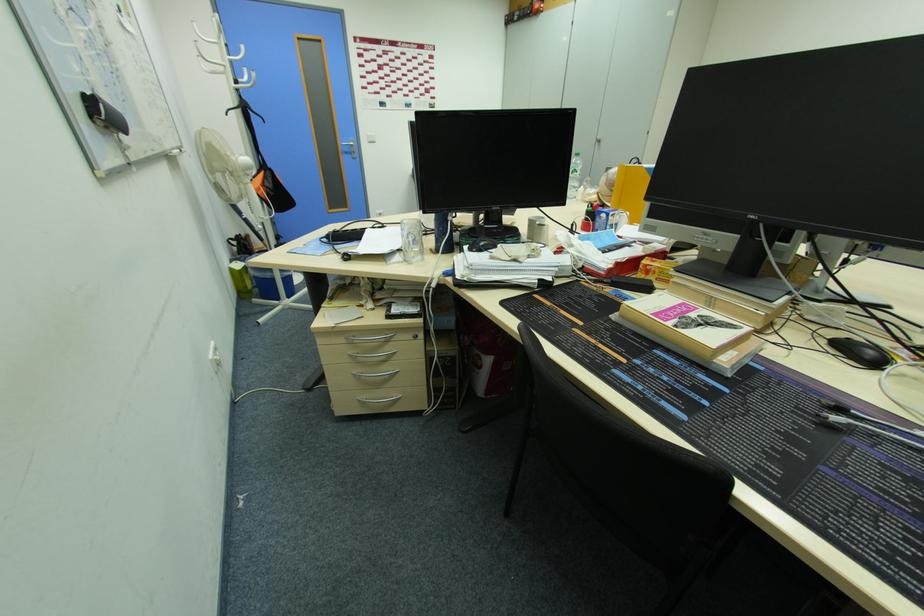
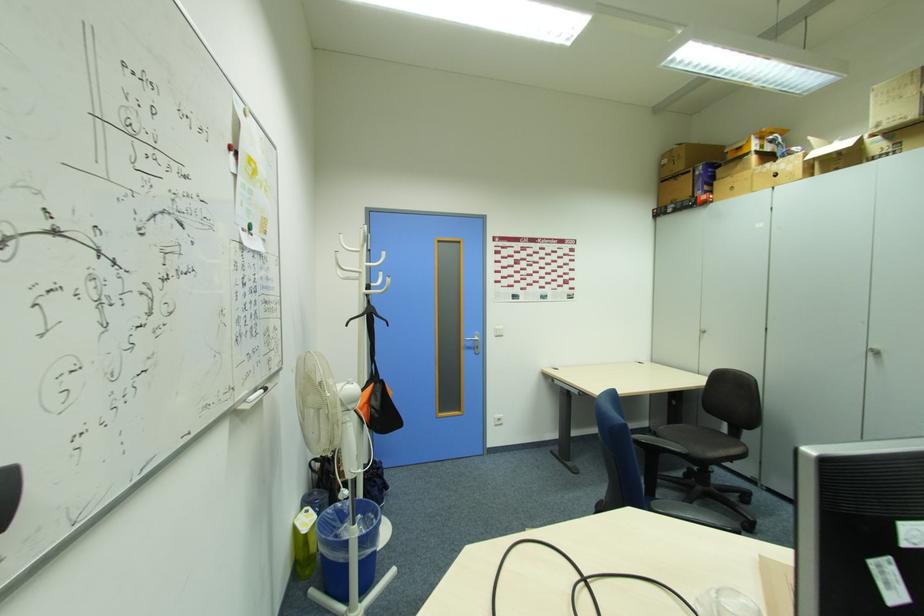
The point at (257, 257) is marked in the first image. Where is the corresponding point in the second image?

(334, 512)